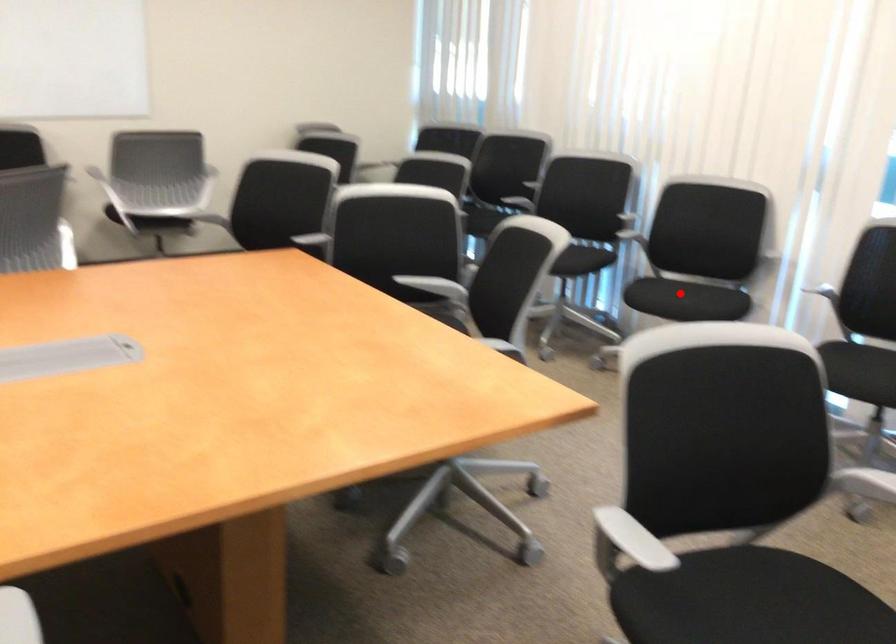
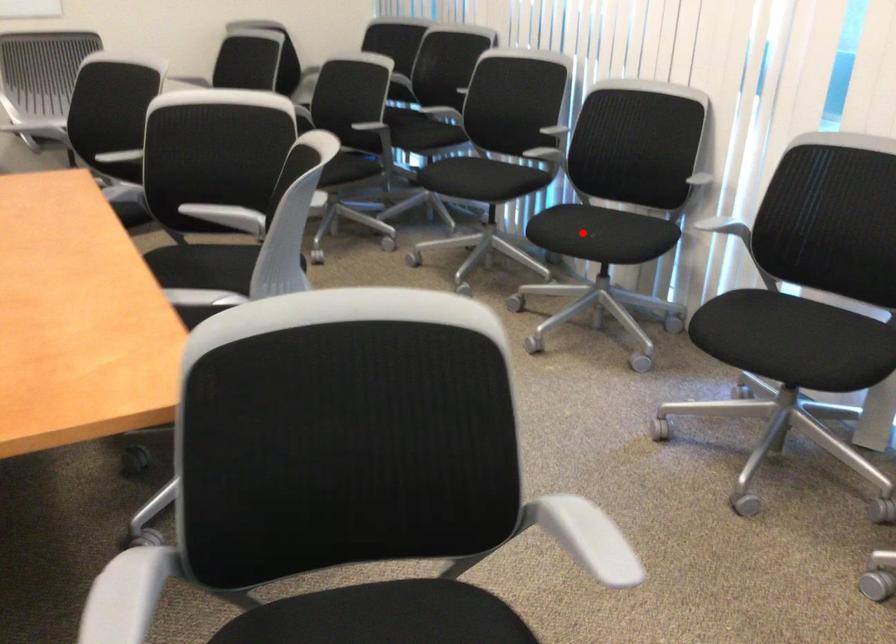
I am providing you with two images of the same scene from different viewpoints. A red point is marked on the first image and another point is marked on the second image. Is the marked point in image1 the same physical position as the marked point in image2?

Yes